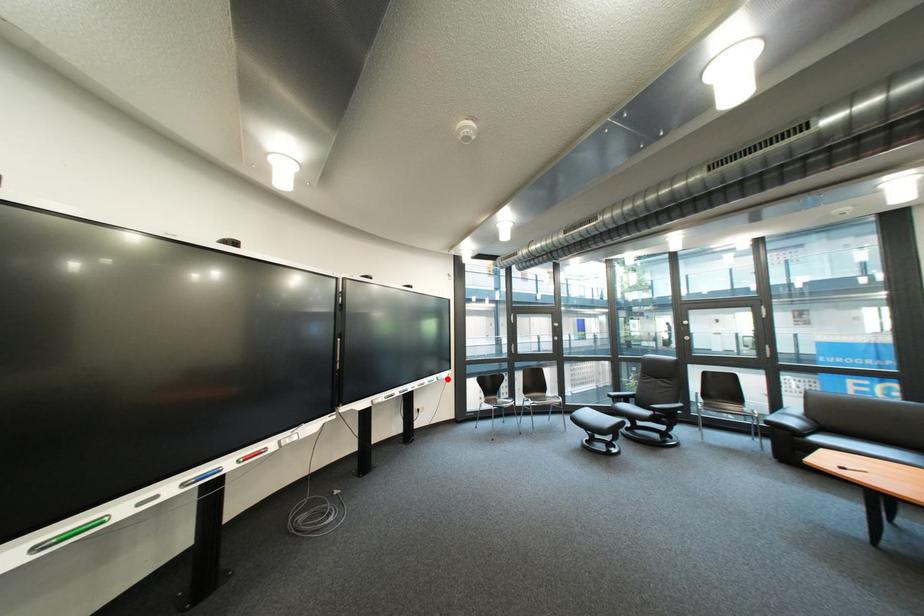
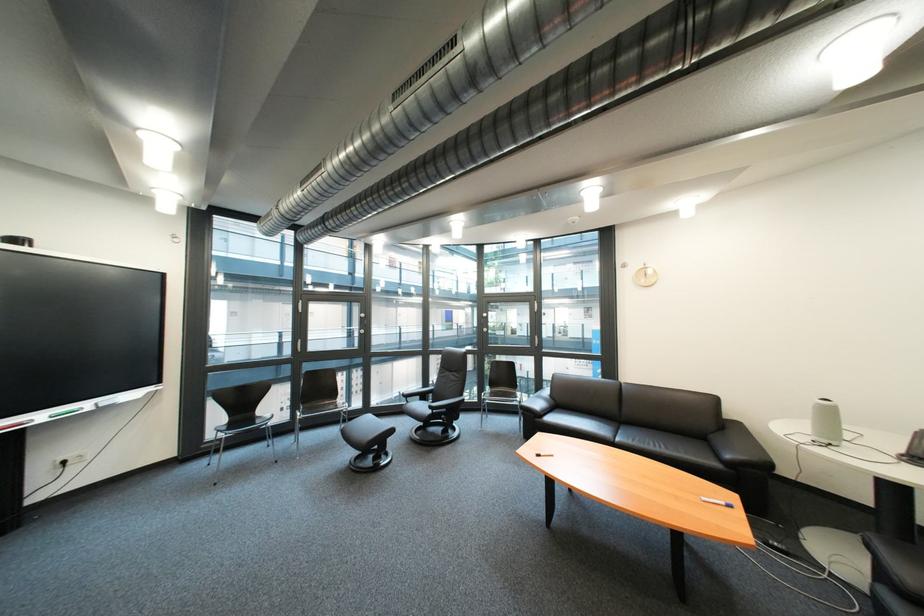
Question: A red point is marked in image1. In image2, is the corresponding 3D point closer to the camera or farther? Reply with the corresponding letter.

Choices:
 (A) The corresponding 3D point is closer.
 (B) The corresponding 3D point is farther.

Answer: (A)